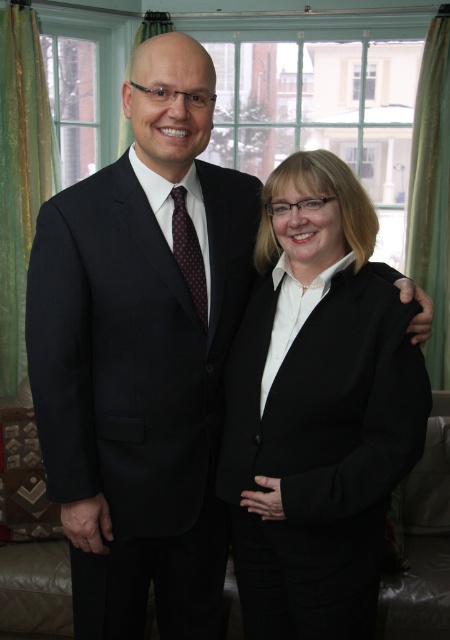
Which is below, green sheer curtain at left or green fabric curtain at upper left?

green sheer curtain at left

Can you confirm if green sheer curtain at left is taller than green fabric curtain at upper left?

Indeed, green sheer curtain at left has a greater height compared to green fabric curtain at upper left.

Where is `green sheer curtain at left`? The height and width of the screenshot is (640, 450). green sheer curtain at left is located at coordinates (21, 176).

From the picture: Who is higher up, dark maroon dotted tie at center or clear glass window at upper center?

clear glass window at upper center is above.

Is point (184, 221) positioned in front of point (372, 88)?

Yes, it is.

The image size is (450, 640). In order to click on dark maroon dotted tie at center in this screenshot , I will do `click(189, 253)`.

Does dark maroon dotted tie at center have a larger size compared to green fabric curtain at upper left?

No.

Who is lower down, dark maroon dotted tie at center or green fabric curtain at upper left?

dark maroon dotted tie at center

Which is in front, point (180, 205) or point (124, 124)?

Positioned in front is point (180, 205).

Where is `dark maroon dotted tie at center`? The width and height of the screenshot is (450, 640). dark maroon dotted tie at center is located at coordinates (189, 253).